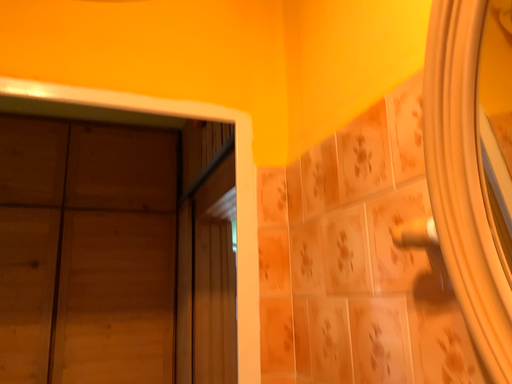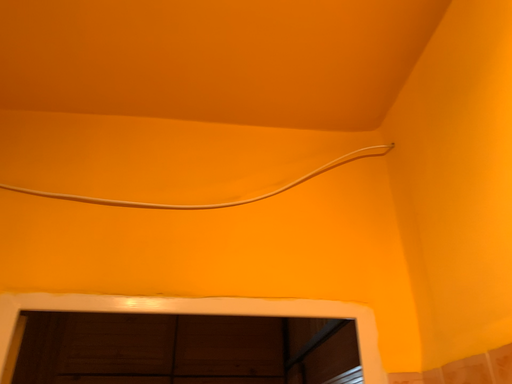
Question: How did the camera likely rotate when shooting the video?

Choices:
 (A) rotated right
 (B) rotated left

Answer: (B)